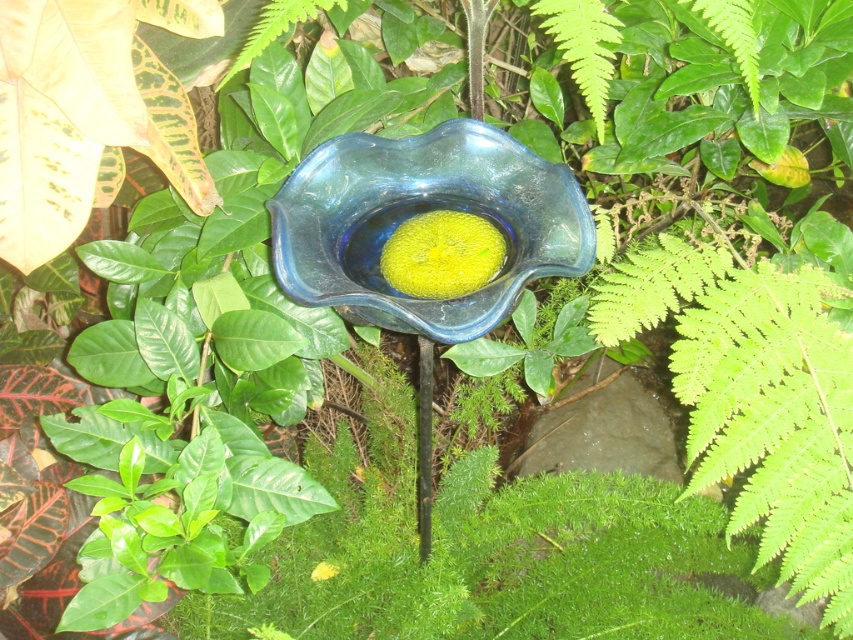
Can you confirm if blue glass bowl at center is positioned to the left of yellow matte flower at center?

No, blue glass bowl at center is not to the left of yellow matte flower at center.

Is point (577, 236) behind point (312, 570)?

No, (577, 236) is in front of (312, 570).

This screenshot has height=640, width=853. In order to click on blue glass bowl at center in this screenshot , I will do (421, 212).